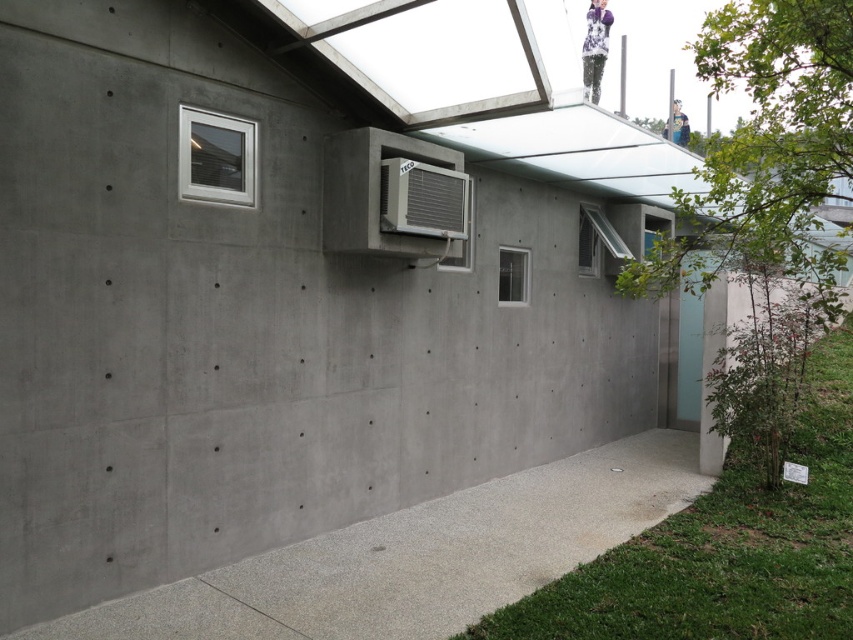
Who is higher up, clear glass window at upper right or blue denim jacket at upper center?

Positioned higher is blue denim jacket at upper center.

Who is more distant from viewer, (611,232) or (674,102)?

Point (674,102)

The image size is (853, 640). Find the location of `clear glass window at upper right`. clear glass window at upper right is located at coordinates (607, 237).

Does white plastic window at upper left have a greater height compared to blue denim jacket at upper center?

No, white plastic window at upper left is not taller than blue denim jacket at upper center.

Describe the element at coordinates (216, 157) in the screenshot. I see `white plastic window at upper left` at that location.

You are a GUI agent. You are given a task and a screenshot of the screen. Output one action in this format:
    pyautogui.click(x=<x>, y=<y>)
    Task: Click on the white plastic window at upper left
    The image size is (853, 640).
    Given the screenshot: What is the action you would take?
    pyautogui.click(x=216, y=157)

Between clear glass window at center and blue denim jacket at upper center, which one appears on the left side from the viewer's perspective?

Positioned to the left is clear glass window at center.

Which of these two, clear glass window at center or blue denim jacket at upper center, stands taller?

blue denim jacket at upper center

Is point (509, 276) farther from camera compared to point (666, 132)?

No, it is in front of (666, 132).

The width and height of the screenshot is (853, 640). In order to click on clear glass window at center in this screenshot , I will do `click(514, 275)`.